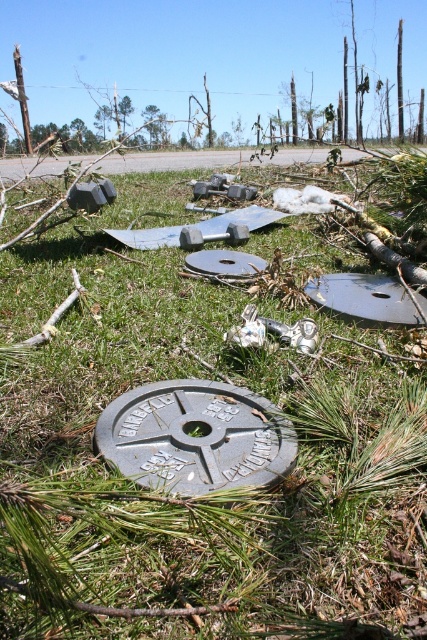
Which is above, black rubber manhole cover at center or green leafy tree at upper center?

green leafy tree at upper center is above.

Who is positioned more to the left, black rubber manhole cover at center or green leafy tree at upper center?

green leafy tree at upper center

Identify the location of black rubber manhole cover at center. The image size is (427, 640). (363, 298).

Who is more distant from viewer, [211,256] or [151,129]?

The point [151,129] is more distant.

Which is more to the right, black metallic manhole cover at center or green leafy tree at upper center?

black metallic manhole cover at center is more to the right.

Who is more distant from viewer, (187, 256) or (152, 106)?

The point (152, 106) is behind.

Image resolution: width=427 pixels, height=640 pixels. I want to click on black metallic manhole cover at center, so pyautogui.click(x=225, y=262).

In the scene shown: Which of these two, black rubber manhole cover at center or gray metallic manhole cover at center, stands shorter?

With less height is gray metallic manhole cover at center.

At what (x,y) coordinates should I click in order to perform the action: click on black rubber manhole cover at center. Please return your answer as a coordinate pair (x, y). The width and height of the screenshot is (427, 640). Looking at the image, I should click on (363, 298).